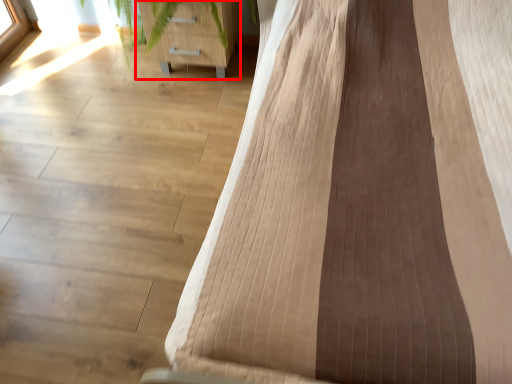
Question: Considering the relative positions of furniture (annotated by the red box) and furniture in the image provided, where is furniture (annotated by the red box) located with respect to the staircase?

Choices:
 (A) right
 (B) left

Answer: (B)